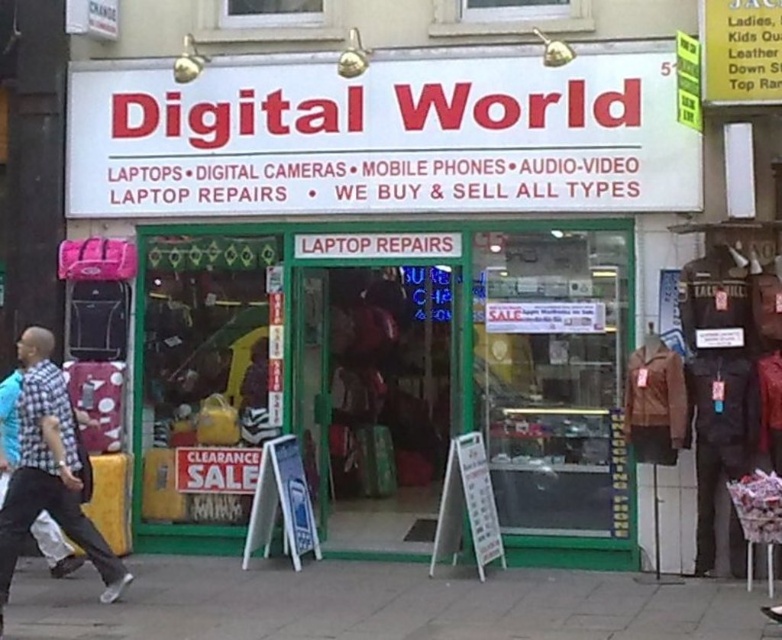
Where is `leather jacket at center`? leather jacket at center is located at coordinates (391, 273).

Is leather jacket at center closer to camera compared to gray concrete pavement at lower center?

No, leather jacket at center is behind gray concrete pavement at lower center.

Find the location of a particular element. The image size is (782, 640). leather jacket at center is located at coordinates (391, 273).

Can you confirm if leather jacket at center is thinner than checkered fabric shirt at left?

Correct, leather jacket at center's width is less than checkered fabric shirt at left's.

Between leather jacket at center and checkered fabric shirt at left, which one is positioned lower?

checkered fabric shirt at left is lower down.

Who is more forward, [522,486] or [22,417]?

Point [22,417] is in front.

In order to click on leather jacket at center in this screenshot , I will do `click(391, 273)`.

Does gray concrete pavement at lower center have a greater width compared to checkered fabric shirt at left?

Yes.

Describe the element at coordinates (377, 604) in the screenshot. This screenshot has width=782, height=640. I see `gray concrete pavement at lower center` at that location.

Describe the element at coordinates (377, 604) in the screenshot. The height and width of the screenshot is (640, 782). I see `gray concrete pavement at lower center` at that location.

Locate an element on the screen. This screenshot has width=782, height=640. gray concrete pavement at lower center is located at coordinates (377, 604).